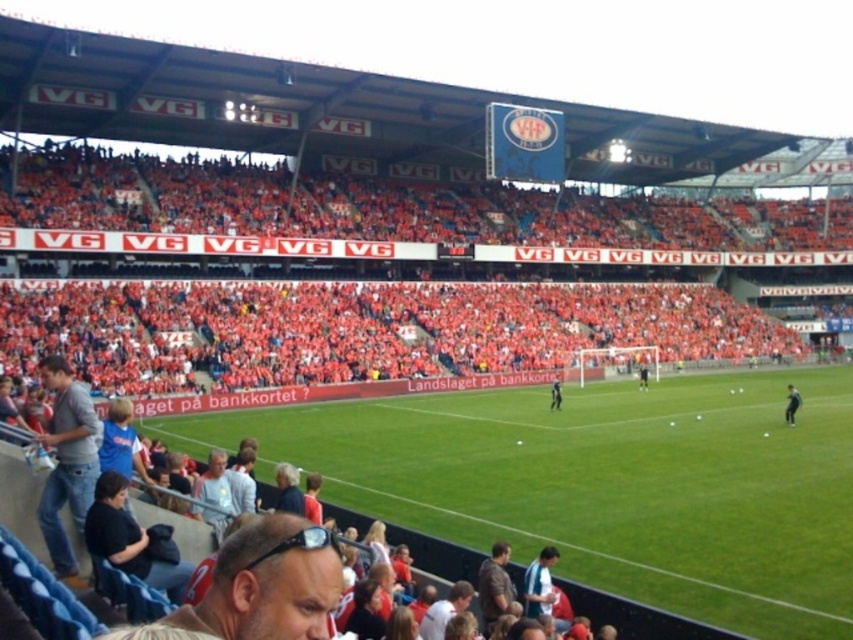
Question: Does orange fabric seats at upper left have a lesser width compared to brown leather jacket at lower center?

Choices:
 (A) no
 (B) yes

Answer: (A)

Question: Does black fabric jacket at lower left appear on the right side of brown leather jacket at lower center?

Choices:
 (A) no
 (B) yes

Answer: (A)

Question: Among these objects, which one is nearest to the camera?

Choices:
 (A) brown leather jacket at lower center
 (B) black fabric jacket at lower left

Answer: (B)

Question: Which point appears closest to the camera in this image?

Choices:
 (A) (108, 492)
 (B) (229, 620)

Answer: (B)

Question: Which point appears closest to the camera in this image?

Choices:
 (A) (271, 573)
 (B) (90, 465)
 (C) (672, 240)
 (D) (103, 502)

Answer: (A)

Question: In this image, where is orange fabric seats at upper left located relative to black fabric jacket at lower left?

Choices:
 (A) left
 (B) right

Answer: (B)